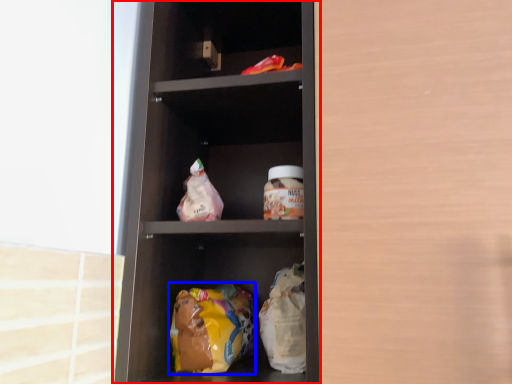
Question: Which point is closer to the camera, shelf (highlighted by a red box) or food (highlighted by a blue box)?

Choices:
 (A) shelf
 (B) food

Answer: (A)